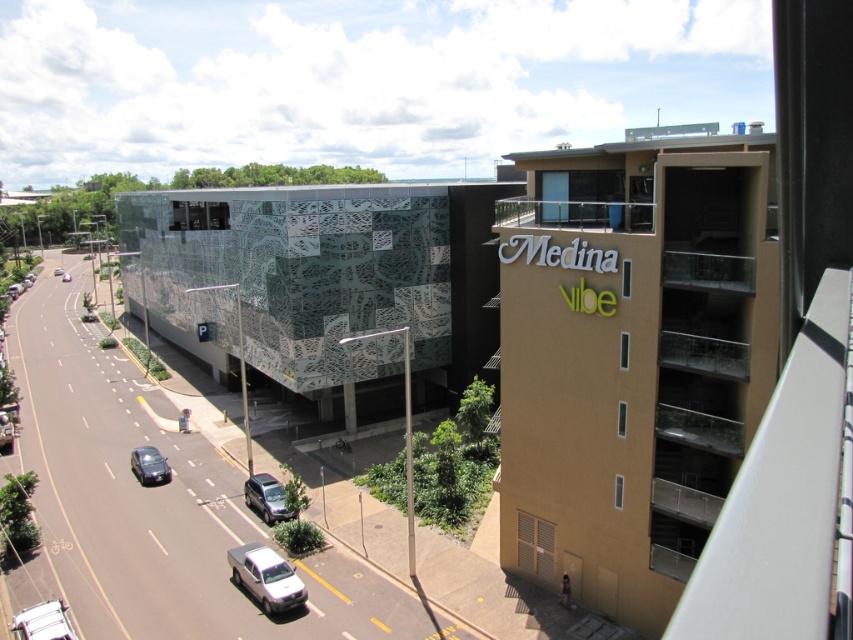
You are a delivery driver approaching the area shown in the image. You need to park your vehicle between the white matte car at lower left and the metallic silver suv at center. Is there enough space between them for your vehicle?

The white matte car at lower left is located below the metallic silver suv at center, so there is vertical space between them. However, without knowing the exact dimensions of your vehicle and the available space, it is difficult to determine if there is enough space to park between them.